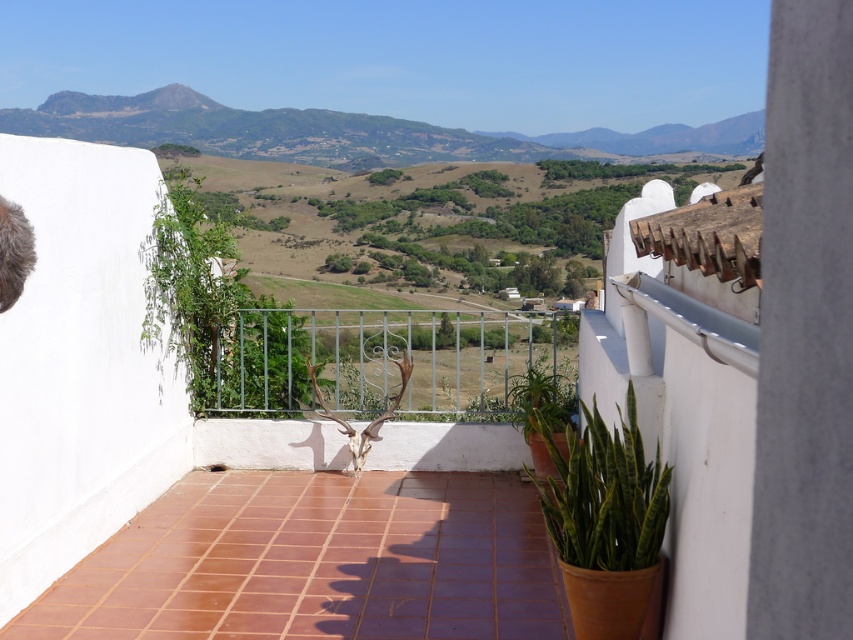
Can you confirm if terracotta tile terrace at center is positioned above rugged brown mountain at upper center?

No, terracotta tile terrace at center is not above rugged brown mountain at upper center.

In the scene shown: Who is more forward, (30, 179) or (245, 112)?

Positioned in front is point (30, 179).

Is point (94, 211) less distant than point (682, 148)?

Yes, it is.

Find the location of a particular element. This screenshot has width=853, height=640. terracotta tile terrace at center is located at coordinates (96, 371).

Can you confirm if terracotta tile terrace at center is smaller than green glossy snake plant at lower right?

No.

Between terracotta tile terrace at center and green glossy snake plant at lower right, which one is positioned lower?

green glossy snake plant at lower right is below.

This screenshot has width=853, height=640. I want to click on terracotta tile terrace at center, so click(96, 371).

Is rugged brown mountain at upper center to the left of green glossy snake plant at lower right from the viewer's perspective?

Indeed, rugged brown mountain at upper center is positioned on the left side of green glossy snake plant at lower right.

Between rugged brown mountain at upper center and green glossy snake plant at lower right, which one has more height?

Standing taller between the two is rugged brown mountain at upper center.

Is point (230, 150) closer to camera compared to point (619, 499)?

No, it is behind (619, 499).

You are a GUI agent. You are given a task and a screenshot of the screen. Output one action in this format:
    pyautogui.click(x=<x>, y=<y>)
    Task: Click on the rugged brown mountain at upper center
    
    Given the screenshot: What is the action you would take?
    pyautogui.click(x=352, y=132)